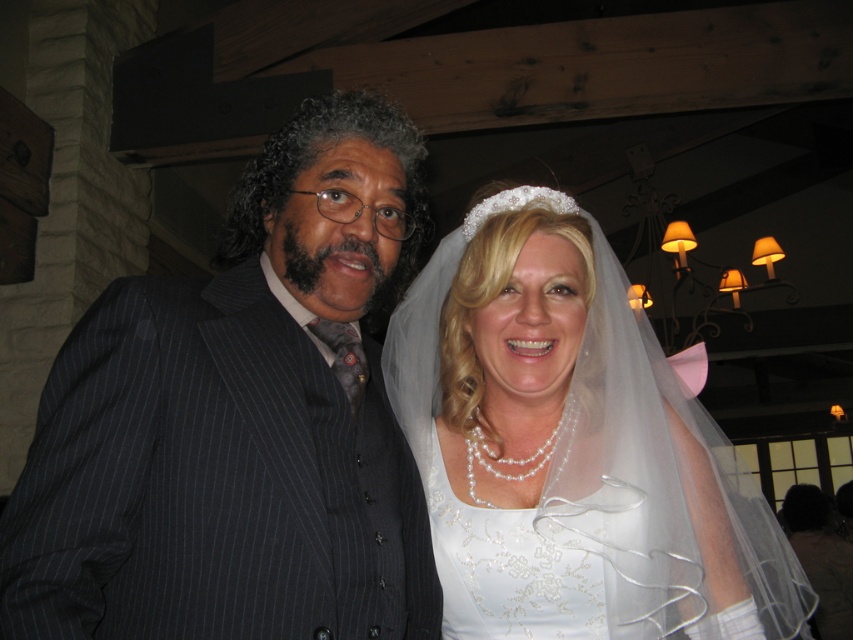
Does dark pinstripe suit at left appear over white satin dress at center?

Yes.

Which is behind, point (28, 532) or point (602, 344)?

The point (602, 344) is more distant.

You are a GUI agent. You are given a task and a screenshot of the screen. Output one action in this format:
    pyautogui.click(x=<x>, y=<y>)
    Task: Click on the dark pinstripe suit at left
    This screenshot has height=640, width=853.
    Given the screenshot: What is the action you would take?
    pyautogui.click(x=239, y=422)